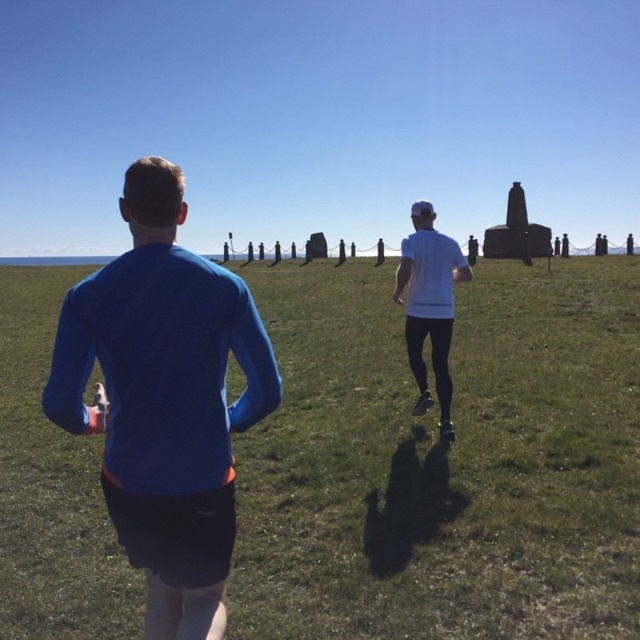
Who is positioned more to the left, green grass at center or white matte shirt at center?

green grass at center

Does green grass at center have a smaller size compared to white matte shirt at center?

Actually, green grass at center might be larger than white matte shirt at center.

The width and height of the screenshot is (640, 640). I want to click on green grass at center, so click(x=444, y=460).

Can you confirm if green grass at center is positioned below blue fabric shirt at center?

No.

Does point (312, 552) come behind point (108, 497)?

Yes, point (312, 552) is behind point (108, 497).

Locate an element on the screen. green grass at center is located at coordinates (444, 460).

Is blue fabric shirt at center thinner than white matte shirt at center?

Incorrect, blue fabric shirt at center's width is not less than white matte shirt at center's.

Is blue fabric shirt at center wider than white matte shirt at center?

Correct, the width of blue fabric shirt at center exceeds that of white matte shirt at center.

Measure the distance between blue fabric shirt at center and camera.

A distance of 2.43 meters exists between blue fabric shirt at center and camera.

Where is `blue fabric shirt at center`? blue fabric shirt at center is located at coordinates (164, 401).